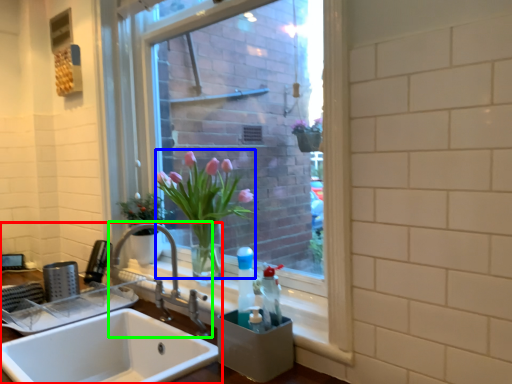
Question: Which object is positioned closest to sink (highlighted by a red box)? Select from floral arrangement (highlighted by a blue box) and tap (highlighted by a green box).

Choices:
 (A) floral arrangement
 (B) tap

Answer: (B)